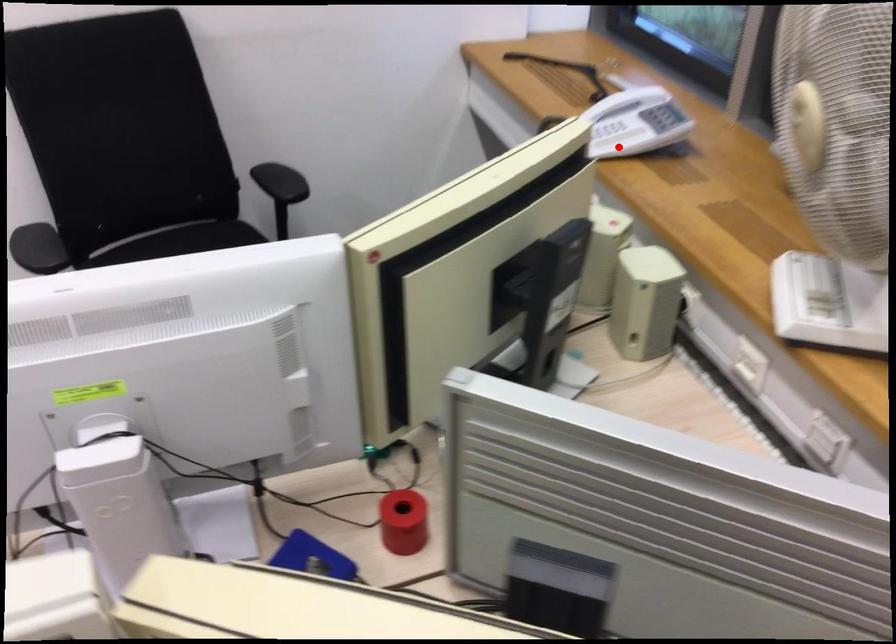
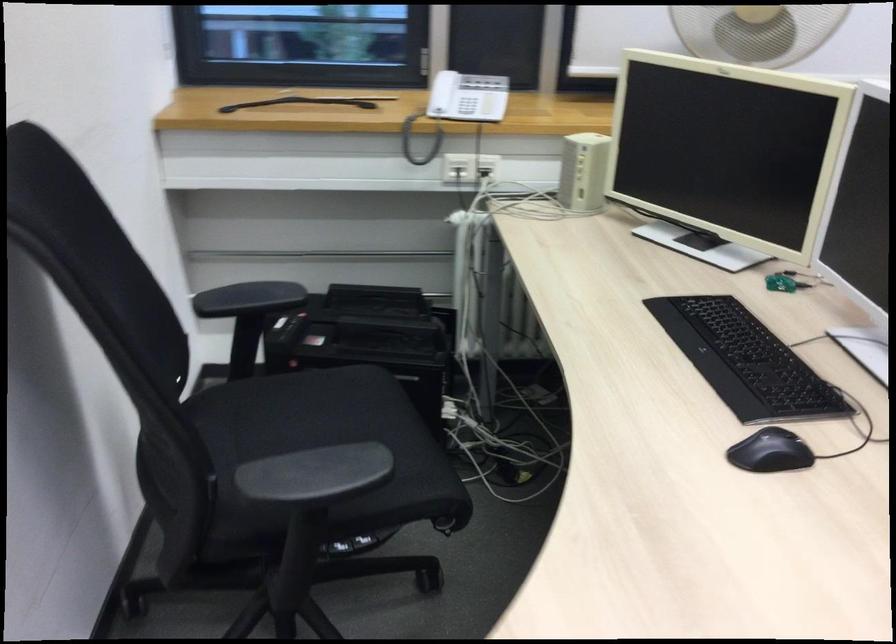
Where in the second image is the point corresponding to the highlighted location from the first image?

(459, 106)